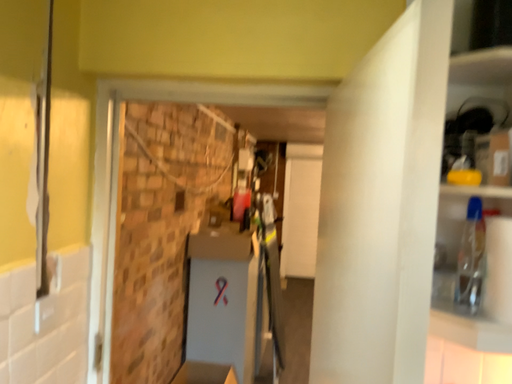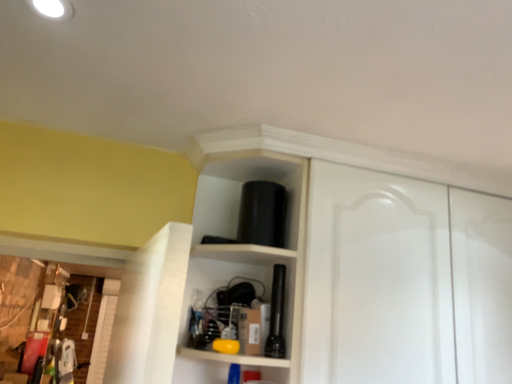
Question: How did the camera likely rotate when shooting the video?

Choices:
 (A) rotated upward
 (B) rotated downward

Answer: (A)